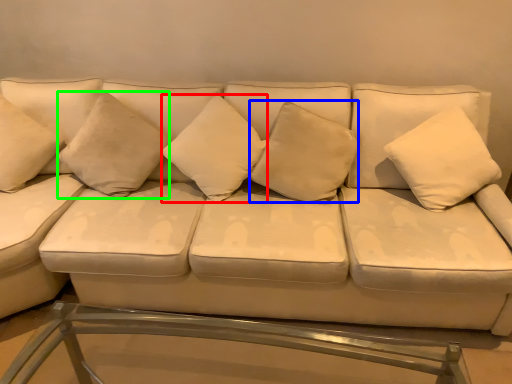
Question: Based on their relative distances, which object is farther from pillow (highlighted by a red box)? Choose from pillow (highlighted by a blue box) and pillow (highlighted by a green box).

Choices:
 (A) pillow
 (B) pillow

Answer: (B)